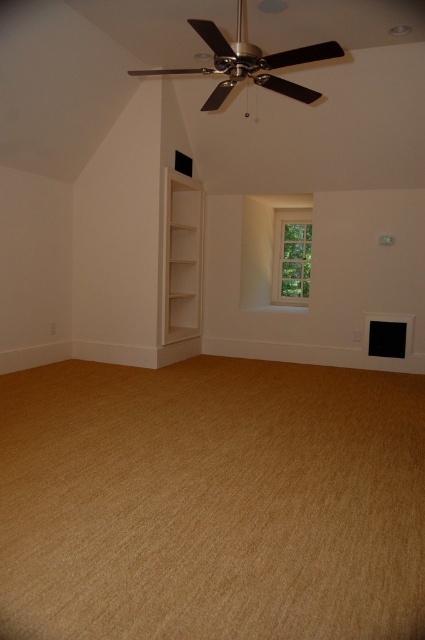
Question: Is white wood bookshelf at lower left positioned in front of clear glass window at center?

Choices:
 (A) no
 (B) yes

Answer: (B)

Question: Among these points, which one is farthest from the camera?

Choices:
 (A) (164, 342)
 (B) (280, 291)

Answer: (B)

Question: Does white wood bookshelf at lower left come behind clear glass window at center?

Choices:
 (A) no
 (B) yes

Answer: (A)

Question: Which point is closer to the camera taking this photo?

Choices:
 (A) (181, 268)
 (B) (303, 276)

Answer: (A)

Question: Does white wood bookshelf at lower left appear over clear glass window at center?

Choices:
 (A) no
 (B) yes

Answer: (A)